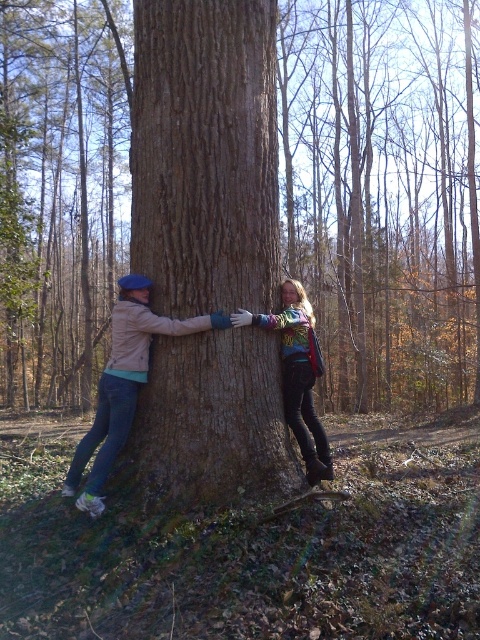
Is brown rough tree trunk at center bigger than rainbow-patterned sweater at center?

Yes, brown rough tree trunk at center is bigger than rainbow-patterned sweater at center.

Between brown rough tree trunk at center and rainbow-patterned sweater at center, which one is positioned higher?

Positioned higher is brown rough tree trunk at center.

This screenshot has width=480, height=640. What are the coordinates of `brown rough tree trunk at center` in the screenshot? It's located at (204, 154).

Who is more distant from viewer, [294,170] or [113,344]?

Positioned behind is point [294,170].

Can you confirm if brown rough textured tree trunk at center is shorter than matte brown tree trunk at center?

No, brown rough textured tree trunk at center is not shorter than matte brown tree trunk at center.

The height and width of the screenshot is (640, 480). Identify the location of brown rough textured tree trunk at center. (384, 193).

Image resolution: width=480 pixels, height=640 pixels. I want to click on brown rough textured tree trunk at center, so tap(384, 193).

Is the position of brown rough textured tree trunk at center less distant than that of brown rough tree trunk at center?

No.

Is brown rough textured tree trunk at center above brown rough tree trunk at center?

Yes, brown rough textured tree trunk at center is above brown rough tree trunk at center.

Is point (439, 202) farther from viewer compared to point (266, 272)?

Yes, it is behind point (266, 272).

This screenshot has width=480, height=640. I want to click on brown rough textured tree trunk at center, so 384,193.